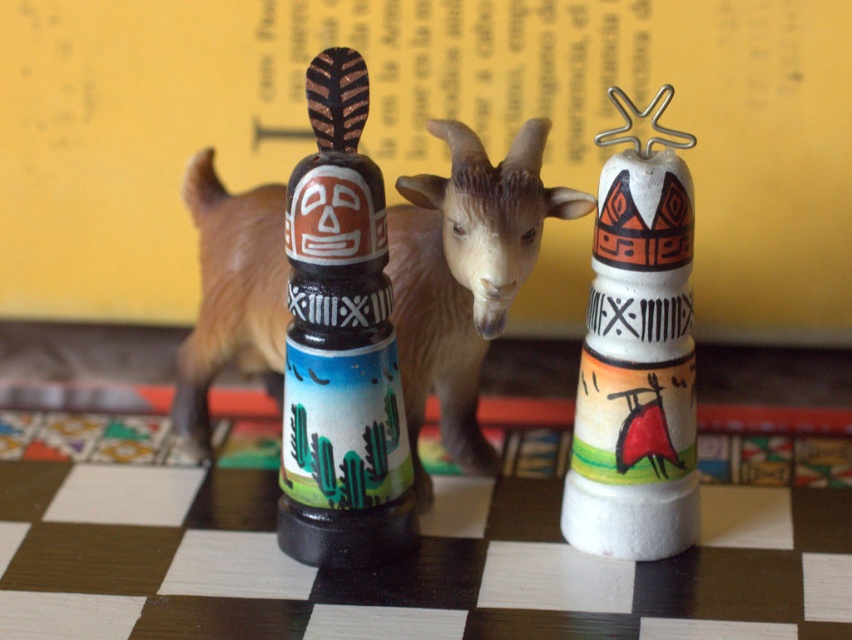
Question: Considering the real-world distances, which object is farthest from the brown plastic goat at center?

Choices:
 (A) white matte totem at right
 (B) matte painted totem pole at center

Answer: (A)

Question: Does brown plastic goat at center appear under white matte totem at right?

Choices:
 (A) yes
 (B) no

Answer: (B)

Question: Is matte painted totem pole at center to the right of white matte totem at right from the viewer's perspective?

Choices:
 (A) yes
 (B) no

Answer: (B)

Question: Is the position of brown plastic goat at center less distant than that of white matte totem at right?

Choices:
 (A) yes
 (B) no

Answer: (B)

Question: Which point is closer to the camera taking this photo?

Choices:
 (A) (346, 564)
 (B) (613, 275)
 (C) (206, 250)

Answer: (B)

Question: Which point is farther to the camera?

Choices:
 (A) matte painted totem pole at center
 (B) white matte totem at right

Answer: (B)